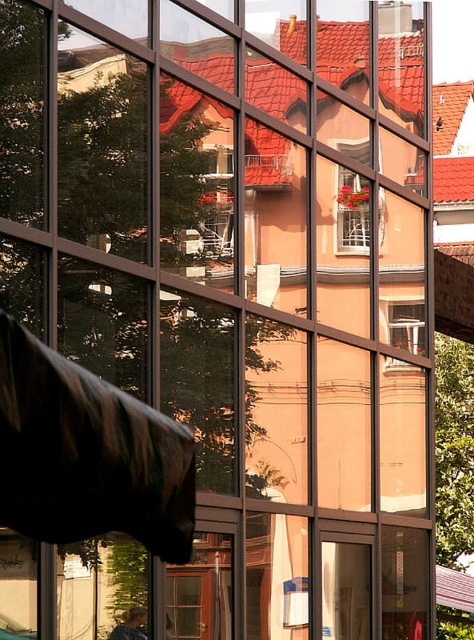
Question: Considering the relative positions of clear glass window at center and white wooden window at center in the image provided, where is clear glass window at center located with respect to white wooden window at center?

Choices:
 (A) above
 (B) below

Answer: (B)

Question: Does clear glass window at center have a larger size compared to white wooden window at center?

Choices:
 (A) yes
 (B) no

Answer: (A)

Question: Which of the following is the farthest from the observer?

Choices:
 (A) white wooden window at center
 (B) clear glass window at center

Answer: (B)

Question: Where is clear glass window at center located in relation to white wooden window at center in the image?

Choices:
 (A) below
 (B) above

Answer: (A)

Question: Which object is farther from the camera taking this photo?

Choices:
 (A) clear glass window at center
 (B) white wooden window at center

Answer: (A)